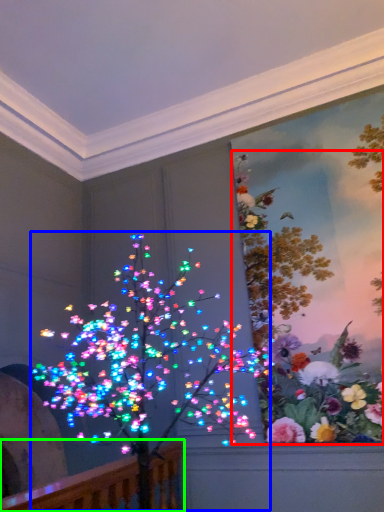
Question: Based on their relative distances, which object is farther from floral arrangement (highlighted by a red box)? Choose from christmas decoration (highlighted by a blue box) and rail (highlighted by a green box).

Choices:
 (A) christmas decoration
 (B) rail

Answer: (B)